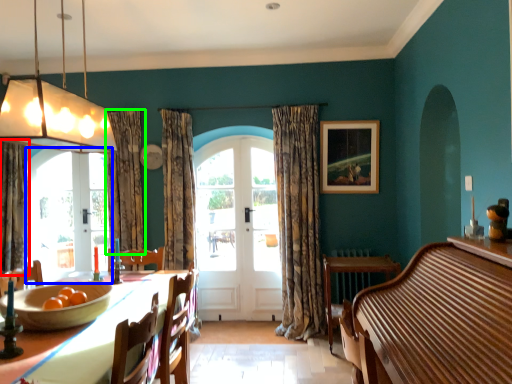
Question: Which object is the closest to the curtain (highlighted by a red box)? Choose among these: bay window (highlighted by a blue box) or curtain (highlighted by a green box).

Choices:
 (A) bay window
 (B) curtain

Answer: (A)